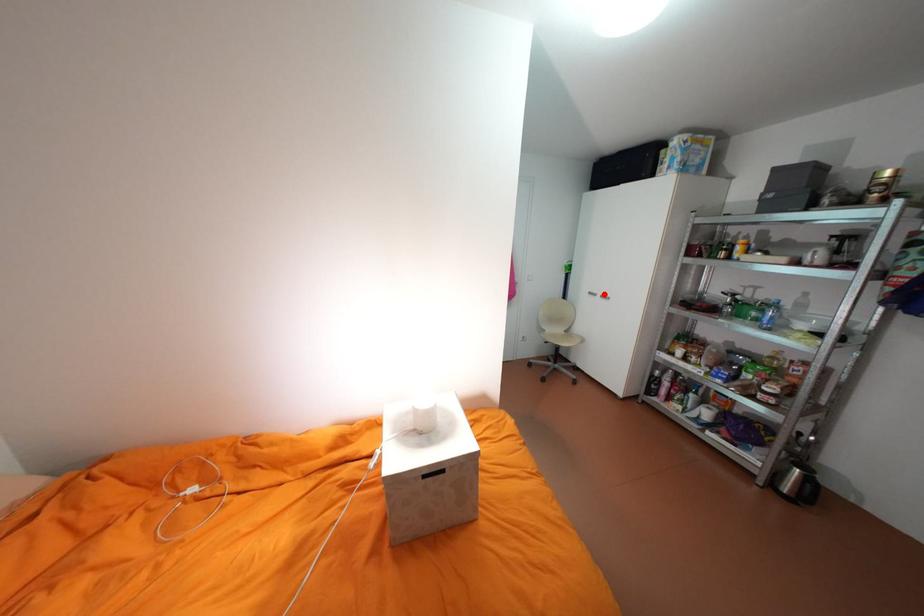
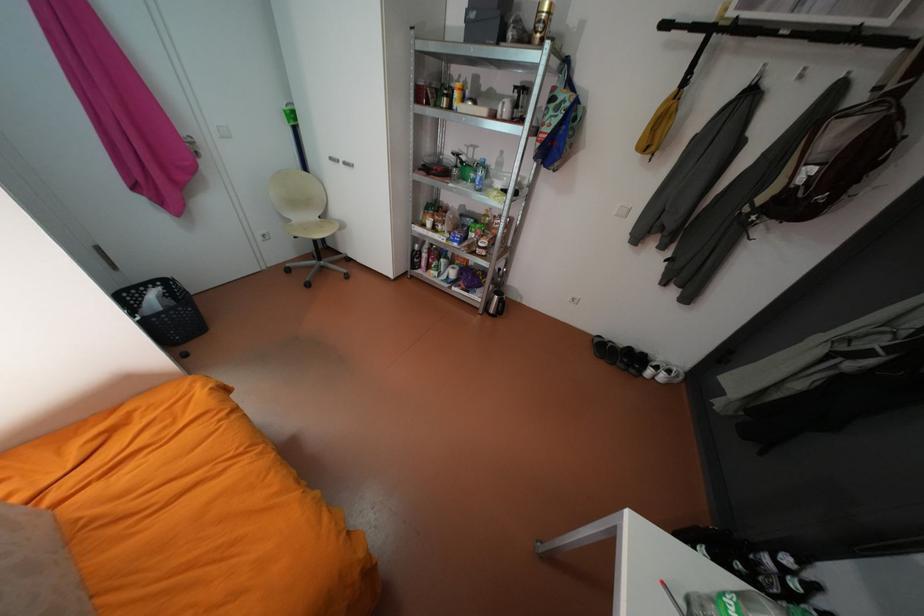
Locate, in the second image, the point that corresponds to the highlighted location in the first image.

(347, 160)